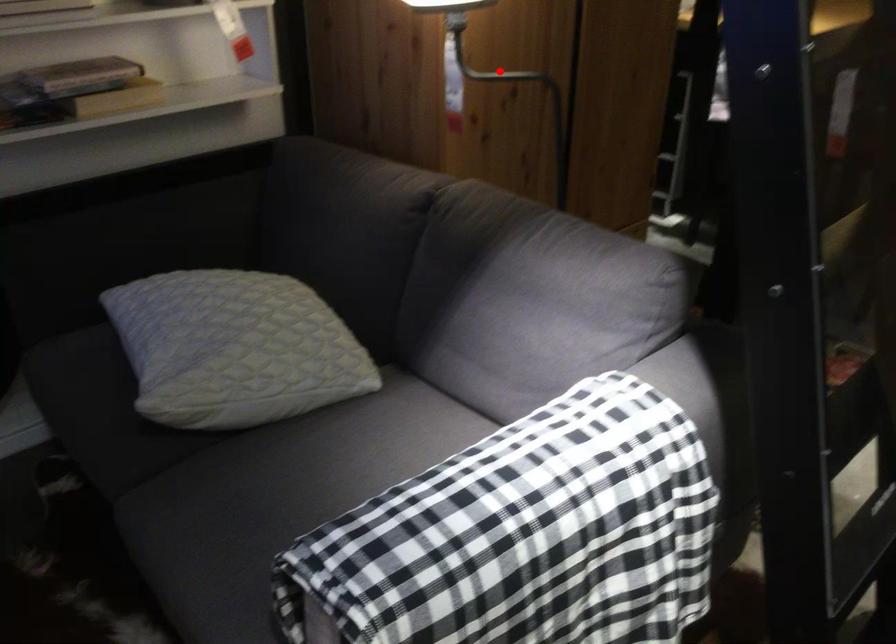
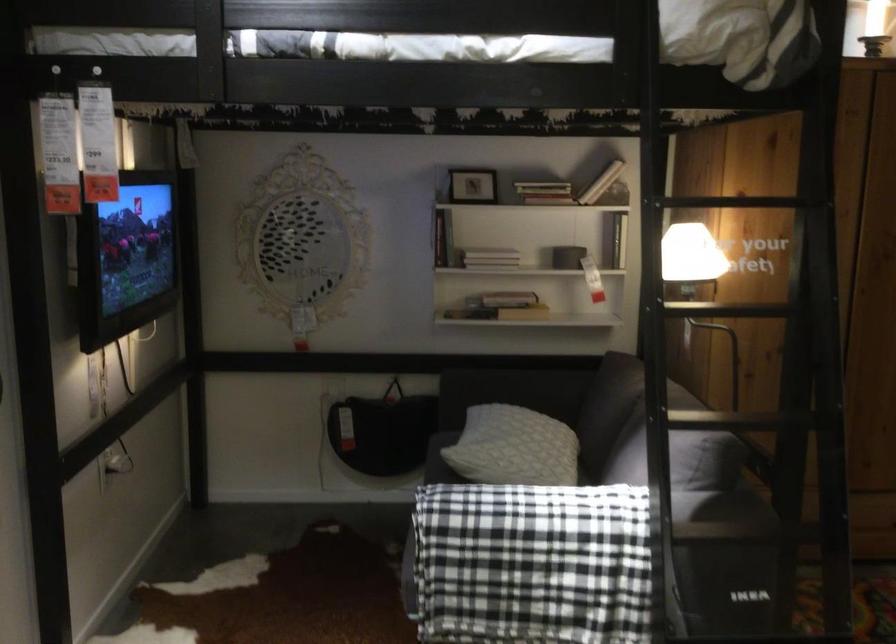
Question: I am providing you with two images of the same scene from different viewpoints. A red point is marked on the first image. Can you still see the location of the red point in image 2?

Choices:
 (A) Yes
 (B) No

Answer: (B)